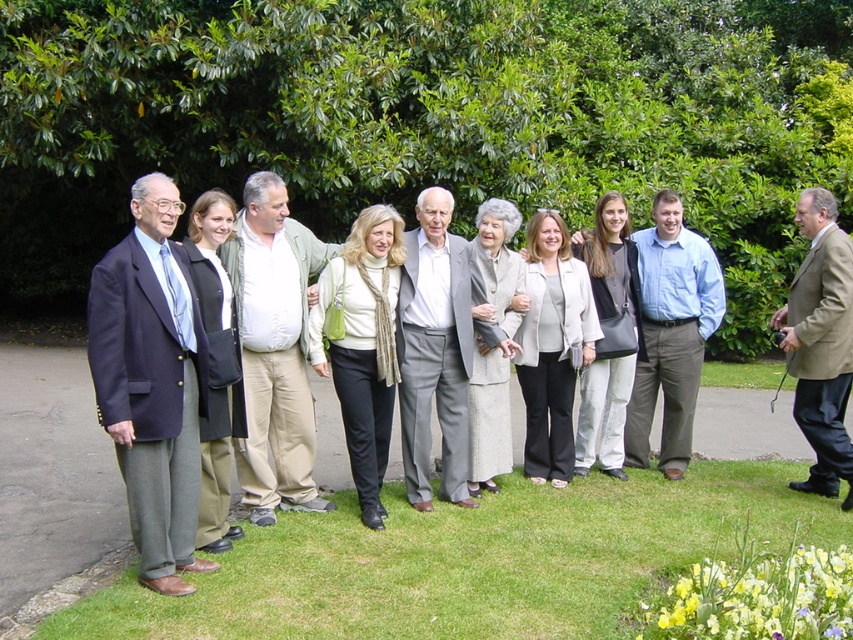
Question: Is green grass at lower center closer to the viewer compared to khaki cotton pants at center?

Choices:
 (A) yes
 (B) no

Answer: (A)

Question: Does gray wool suit at center have a greater width compared to olive-green wool coat at center?

Choices:
 (A) yes
 (B) no

Answer: (A)

Question: Considering the real-world distances, which object is closest to the matte black suit at left?

Choices:
 (A) olive-green wool coat at center
 (B) gray wool suit at center

Answer: (A)

Question: Is matte black suit at left thinner than olive-green wool coat at center?

Choices:
 (A) no
 (B) yes

Answer: (A)

Question: Which point appears farthest from the camera in this image?

Choices:
 (A) (813, 284)
 (B) (262, 305)
 (C) (593, 444)

Answer: (C)

Question: Considering the real-world distances, which object is farthest from the olive-green wool coat at center?

Choices:
 (A) light gray wool coat at center
 (B) gray wool suit at center

Answer: (A)